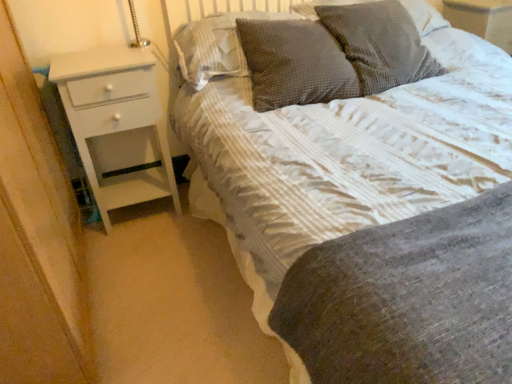
Question: Can you confirm if waffle-textured gray pillow at upper center, marked as the 4th pillow in a right-to-left arrangement, is bigger than white textured bed at center?

Choices:
 (A) yes
 (B) no

Answer: (B)

Question: Is waffle-textured gray pillow at upper center, marked as the 4th pillow in a right-to-left arrangement, placed right next to white textured bed at center?

Choices:
 (A) no
 (B) yes

Answer: (A)

Question: Is waffle-textured gray pillow at upper center, marked as the 4th pillow in a right-to-left arrangement, outside white textured bed at center?

Choices:
 (A) no
 (B) yes

Answer: (A)

Question: Considering the relative positions of waffle-textured gray pillow at upper center, marked as the 4th pillow in a right-to-left arrangement, and white textured bed at center in the image provided, is waffle-textured gray pillow at upper center, marked as the 4th pillow in a right-to-left arrangement, to the right of white textured bed at center from the viewer's perspective?

Choices:
 (A) no
 (B) yes

Answer: (A)

Question: From the image's perspective, does waffle-textured gray pillow at upper center, marked as the 4th pillow in a right-to-left arrangement, appear lower than white textured bed at center?

Choices:
 (A) no
 (B) yes

Answer: (A)

Question: From a real-world perspective, is white textured bed at center above or below woven fabric pillow at upper center, the 4th pillow in the left-to-right sequence?

Choices:
 (A) below
 (B) above

Answer: (A)

Question: Which is correct: white textured bed at center is inside woven fabric pillow at upper center, marked as the first pillow in a right-to-left arrangement, or outside of it?

Choices:
 (A) inside
 (B) outside

Answer: (B)

Question: Is white textured bed at center taller or shorter than woven fabric pillow at upper center, the 4th pillow in the left-to-right sequence?

Choices:
 (A) short
 (B) tall

Answer: (B)

Question: Considering the positions of point (361, 213) and point (301, 13), is point (361, 213) closer or farther from the camera than point (301, 13)?

Choices:
 (A) farther
 (B) closer

Answer: (B)

Question: In terms of height, does dark grey textured pillow at upper center, placed as the second pillow when sorted from left to right, look taller or shorter compared to waffle-textured gray pillow at upper center, acting as the 1th pillow starting from the left?

Choices:
 (A) short
 (B) tall

Answer: (B)

Question: From a real-world perspective, is dark grey textured pillow at upper center, placed as the second pillow when sorted from left to right, physically located above or below waffle-textured gray pillow at upper center, marked as the 4th pillow in a right-to-left arrangement?

Choices:
 (A) above
 (B) below

Answer: (B)

Question: Considering the positions of point (258, 92) and point (222, 62), is point (258, 92) closer or farther from the camera than point (222, 62)?

Choices:
 (A) closer
 (B) farther

Answer: (A)

Question: Is dark grey textured pillow at upper center, positioned as the third pillow in right-to-left order, spatially inside waffle-textured gray pillow at upper center, marked as the 4th pillow in a right-to-left arrangement, or outside of it?

Choices:
 (A) outside
 (B) inside

Answer: (A)

Question: Is woven fabric pillow at upper center, the 4th pillow in the left-to-right sequence, in front of or behind woven fabric pillow at upper center, which is the second pillow from right to left, in the image?

Choices:
 (A) behind
 (B) front

Answer: (A)

Question: From a real-world perspective, relative to woven fabric pillow at upper center, positioned as the 3th pillow in left-to-right order, is woven fabric pillow at upper center, marked as the first pillow in a right-to-left arrangement, vertically above or below?

Choices:
 (A) above
 (B) below

Answer: (A)